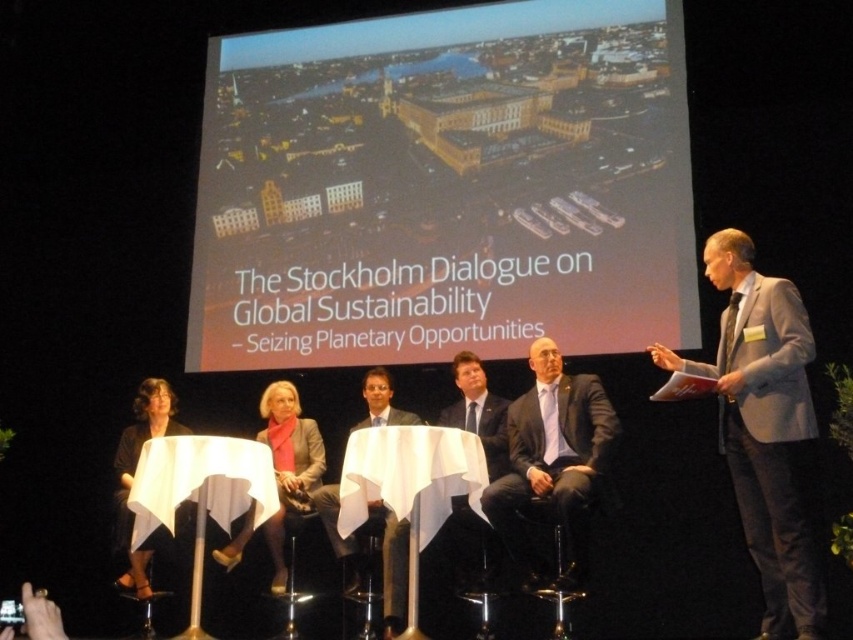
Question: Which point appears farthest from the camera in this image?

Choices:
 (A) (572, 513)
 (B) (723, 426)
 (C) (303, 64)

Answer: (C)

Question: Can you confirm if light gray suit at right is positioned to the left of matte gray blazer at center?

Choices:
 (A) no
 (B) yes

Answer: (A)

Question: Can you confirm if light gray suit at right is positioned below matte gray blazer at center?

Choices:
 (A) no
 (B) yes

Answer: (A)

Question: Considering the relative positions of light gray suit at right and dark gray suit at center in the image provided, where is light gray suit at right located with respect to dark gray suit at center?

Choices:
 (A) right
 (B) left

Answer: (A)

Question: Which point is farther to the camera?

Choices:
 (A) (772, 339)
 (B) (518, 496)

Answer: (B)

Question: Which point is farther to the camera?

Choices:
 (A) black fabric dress at center
 (B) matte gray blazer at center
 (C) light gray suit at right

Answer: (A)